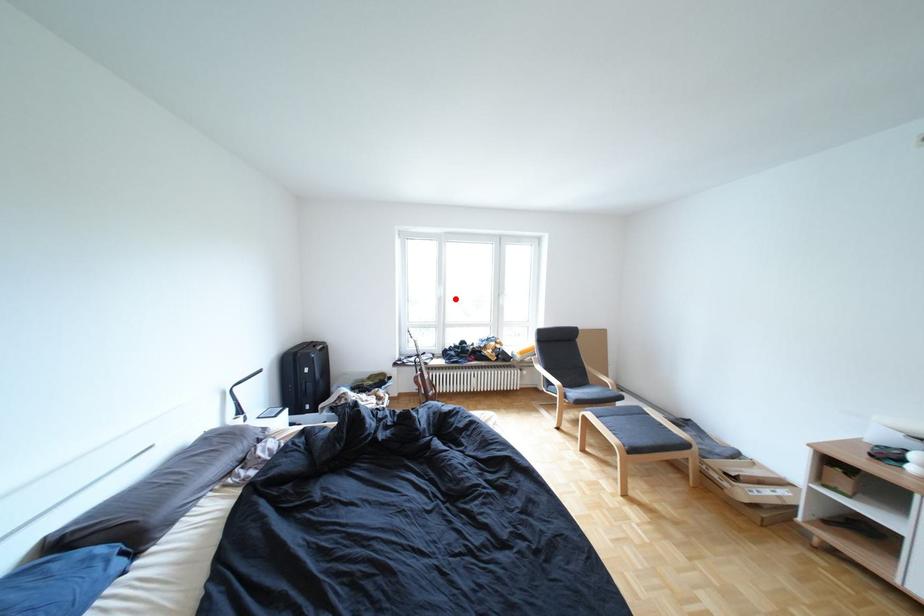
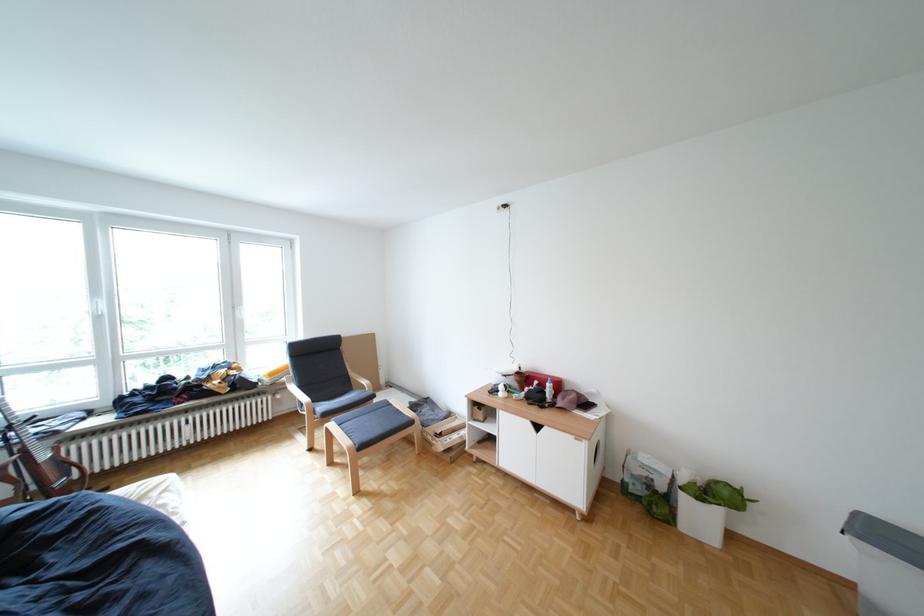
Question: I am providing you with two images of the same scene from different viewpoints. In image1, a red point is highlighted. Considering the same 3D point in image2, which of the following is correct?

Choices:
 (A) It is closer
 (B) It is farther

Answer: (B)